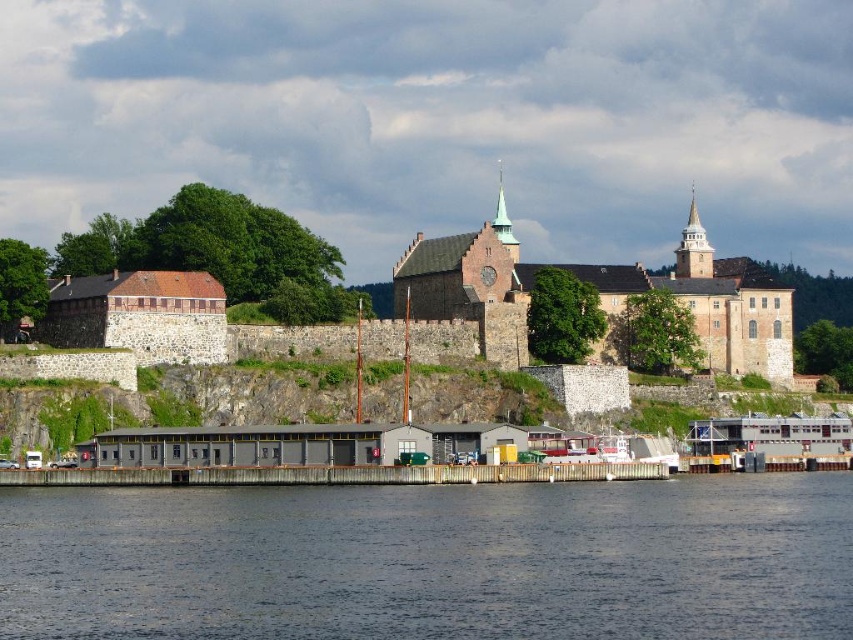
You are standing at the base of the fortress and want to determine which of the two points, point (451, 579) or point (782, 324), is closer to you. Based on the image, which point is nearer?

Point (451, 579) is closer to the viewer than point (782, 324), so it is the nearer point.

You are a tour guide explaining the layout of the historic site to visitors. Pointing to the dark blue water at lower center and the brown stone fort at center, you want to describe their spatial relationship. How would you phrase this?

The dark blue water at lower center is located below the brown stone fort at center, indicating that the fort is situated on higher ground overlooking the water.